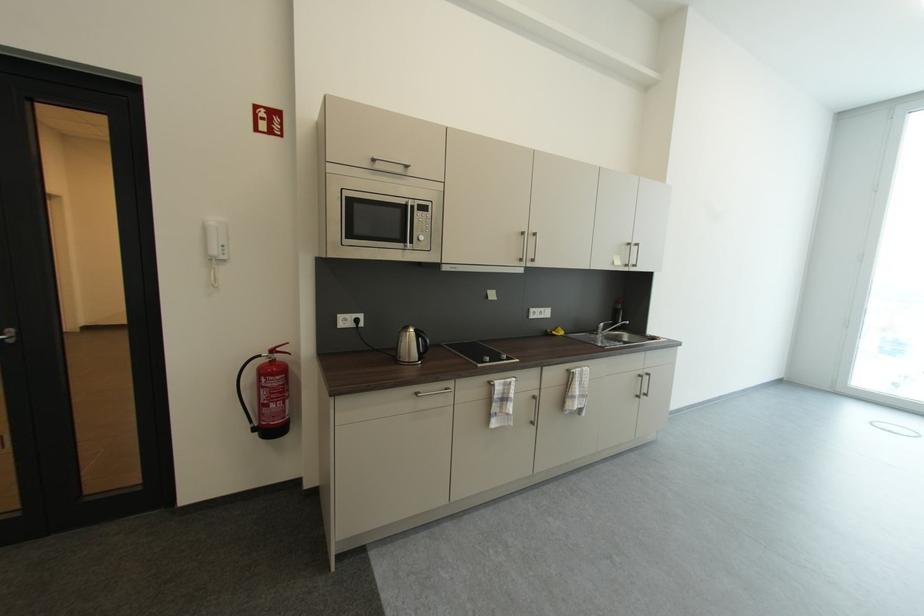
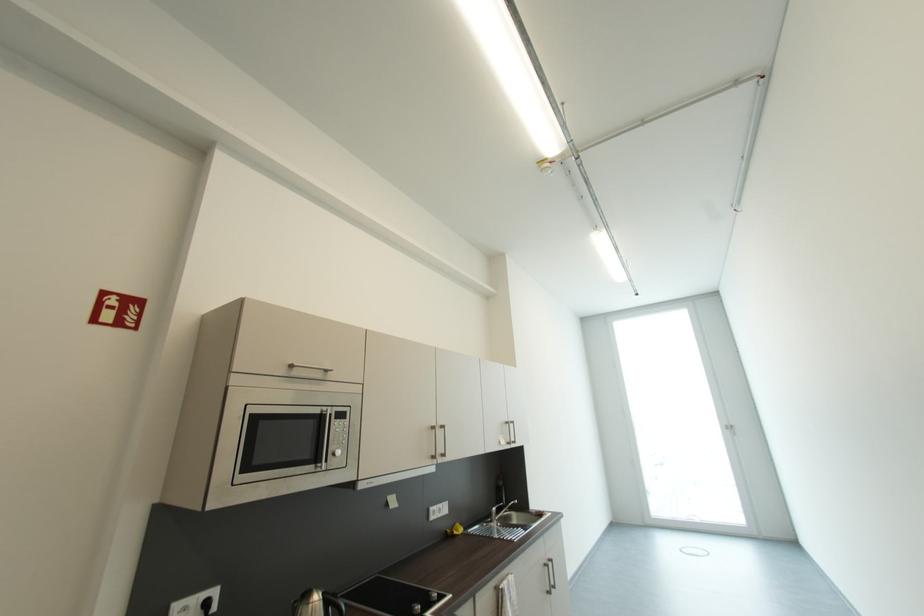
Locate, in the second image, the point that corresponds to (x=647, y=378) in the first image.

(552, 567)